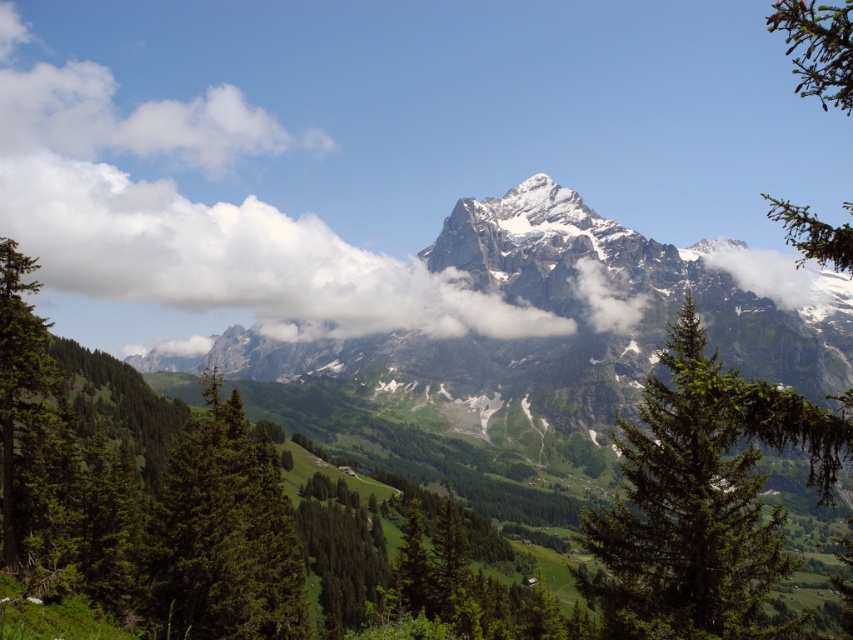
You are standing at the center of the image and want to walk towards the green matte tree at center. In which direction should you move relative to the mountain?

The green matte tree at center is located at the center of the image, so you are already facing it. Move straight ahead towards the center to reach it.